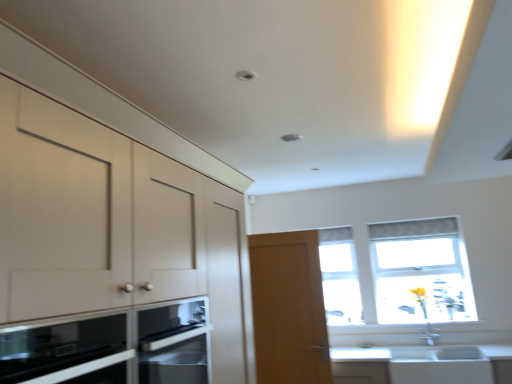
Question: Is light brown wooden door at center smaller than clear glass window at center, the second window when ordered from right to left?

Choices:
 (A) yes
 (B) no

Answer: (B)

Question: From the image's perspective, is light brown wooden door at center located beneath clear glass window at center, the second window when ordered from right to left?

Choices:
 (A) no
 (B) yes

Answer: (B)

Question: Is light brown wooden door at center not near clear glass window at center, which ranks as the first window in left-to-right order?

Choices:
 (A) yes
 (B) no

Answer: (B)

Question: From the image's perspective, would you say light brown wooden door at center is positioned over clear glass window at center, the second window when ordered from right to left?

Choices:
 (A) no
 (B) yes

Answer: (A)

Question: Considering the relative sizes of light brown wooden door at center and clear glass window at center, the second window when ordered from right to left, in the image provided, is light brown wooden door at center taller than clear glass window at center, the second window when ordered from right to left,?

Choices:
 (A) no
 (B) yes

Answer: (B)

Question: Is light brown wooden door at center to the left of clear glass window at center, the second window when ordered from right to left, from the viewer's perspective?

Choices:
 (A) yes
 (B) no

Answer: (A)

Question: From a real-world perspective, does matte white cabinets at left sit lower than clear glass window at center, the second window when ordered from right to left?

Choices:
 (A) yes
 (B) no

Answer: (B)

Question: Is the depth of matte white cabinets at left greater than that of clear glass window at center, which ranks as the first window in left-to-right order?

Choices:
 (A) no
 (B) yes

Answer: (A)

Question: Is matte white cabinets at left located outside clear glass window at center, which ranks as the first window in left-to-right order?

Choices:
 (A) yes
 (B) no

Answer: (A)

Question: Is matte white cabinets at left positioned in front of clear glass window at center, which ranks as the first window in left-to-right order?

Choices:
 (A) no
 (B) yes

Answer: (B)

Question: Does matte white cabinets at left appear on the right side of clear glass window at center, which ranks as the first window in left-to-right order?

Choices:
 (A) yes
 (B) no

Answer: (B)

Question: Considering the relative sizes of matte white cabinets at left and clear glass window at center, the second window when ordered from right to left, in the image provided, is matte white cabinets at left taller than clear glass window at center, the second window when ordered from right to left,?

Choices:
 (A) no
 (B) yes

Answer: (B)

Question: Is light brown wooden door at center positioned before matte white cabinets at left?

Choices:
 (A) no
 (B) yes

Answer: (A)